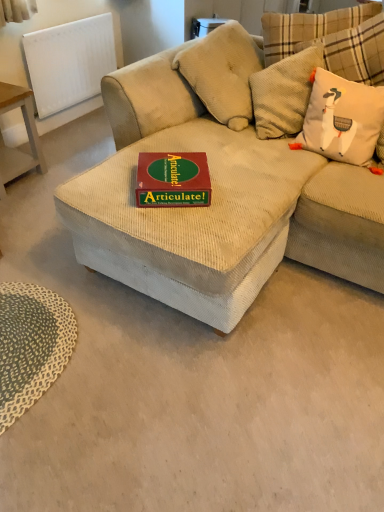
Where is `blank space situated above green textured mat at lower left (from a real-world perspective)`? The image size is (384, 512). blank space situated above green textured mat at lower left (from a real-world perspective) is located at coordinates (30, 328).